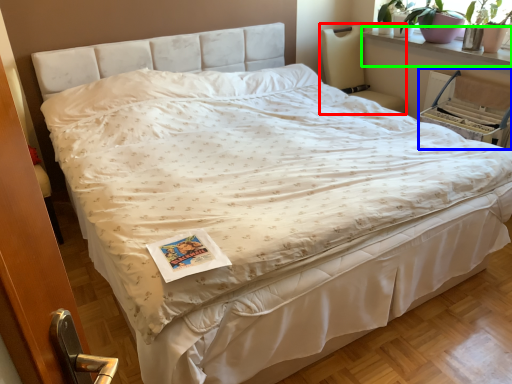
Question: Considering the real-world distances, which object is farthest from rocking chair (highlighted by a red box)? armchair (highlighted by a blue box) or window sill (highlighted by a green box)?

Choices:
 (A) armchair
 (B) window sill

Answer: (A)